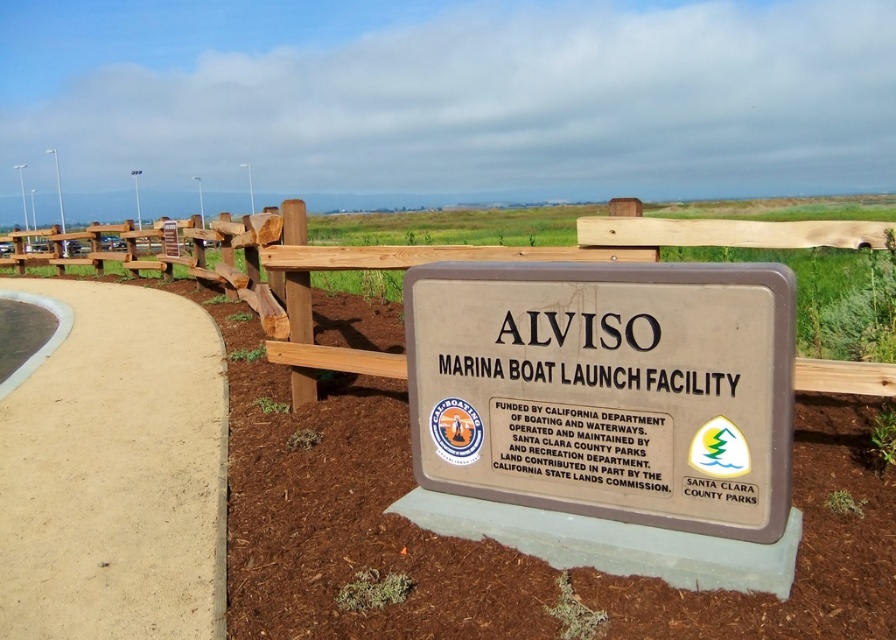
You are a visitor at the Alviso Marina Boat Launch Facility and want to read both the brown polished wood sign at center and the brown wooden sign at center. Which sign should you look at first if you want to read the one higher up?

The brown wooden sign at center is higher up, so you should look at it first before the brown polished wood sign at center located below it.

You are standing in front of the Alviso Marina Boat Launch Facility signboard and want to take a photo of both the brown polished wood sign at center and the brown wooden sign at center. Which sign should you focus on first to ensure both are in the frame?

The brown wooden sign at center is behind the brown polished wood sign at center, so you should focus on the brown polished wood sign at center first to ensure both are in the frame.

You are a visitor standing in front of the Alviso Marina Boat Launch Facility signboard. You notice the brown polished wood sign at center and the light tan concrete at lower left. Which object is located above the other?

The brown polished wood sign at center is positioned over light tan concrete at lower left, meaning it is above the concrete.